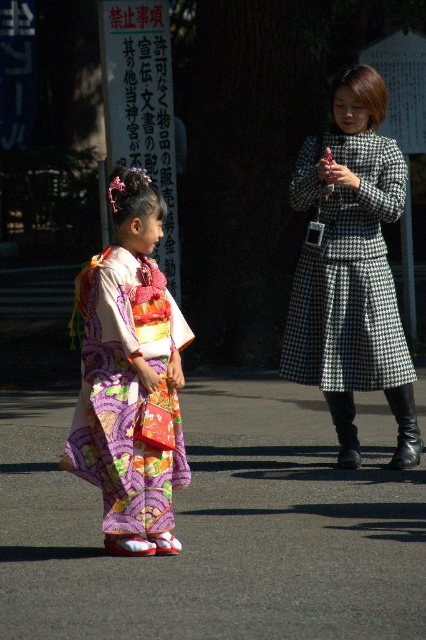
You are a photographer trying to capture the houndstooth wool coat at center in your shot. The camera you are using has a rectangular viewfinder with coordinates ranging from 0 to 1 on both the x and y axes. The center of the viewfinder is at coordinate point 0.5, 0.5. You want to ensure that the houndstooth wool coat at center is positioned exactly at the center of the viewfinder. Is the point (x=348, y=272) within the center area of the viewfinder?

The point (x=348, y=272) is located to the left and above the center point 0.5, 0.5 of the viewfinder. Since the houndstooth wool coat at center corresponds to this point, it means the coat is positioned slightly left and higher than the exact center of the viewfinder. Therefore, it is not exactly at the center.

You are a tailor who needs to determine which clothing item requires more fabric to make between the houndstooth wool coat at center and the multicolored silk kimono at left. Based on the image, which one would need more fabric?

The houndstooth wool coat at center has a larger size compared to the multicolored silk kimono at left, so it would require more fabric to make.